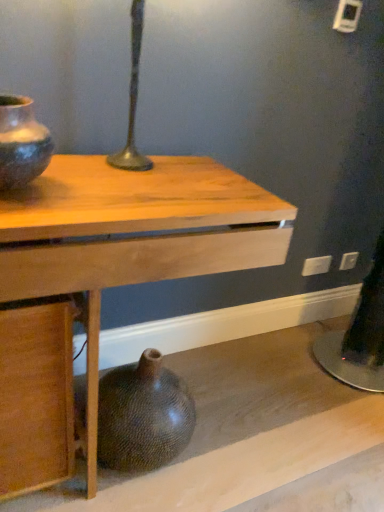
Image resolution: width=384 pixels, height=512 pixels. Find the location of `vacant point to the right of wooden table at center`. vacant point to the right of wooden table at center is located at coordinates (269, 425).